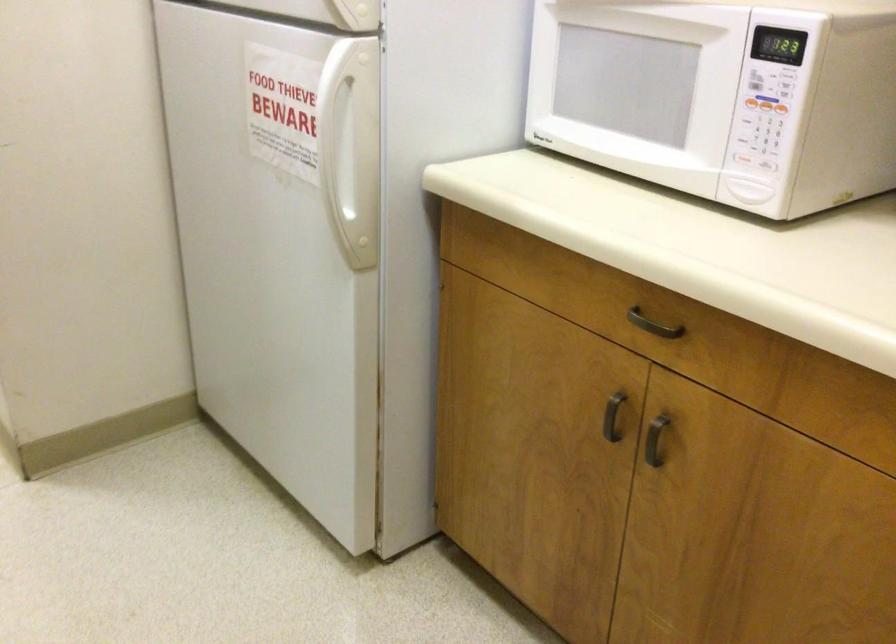
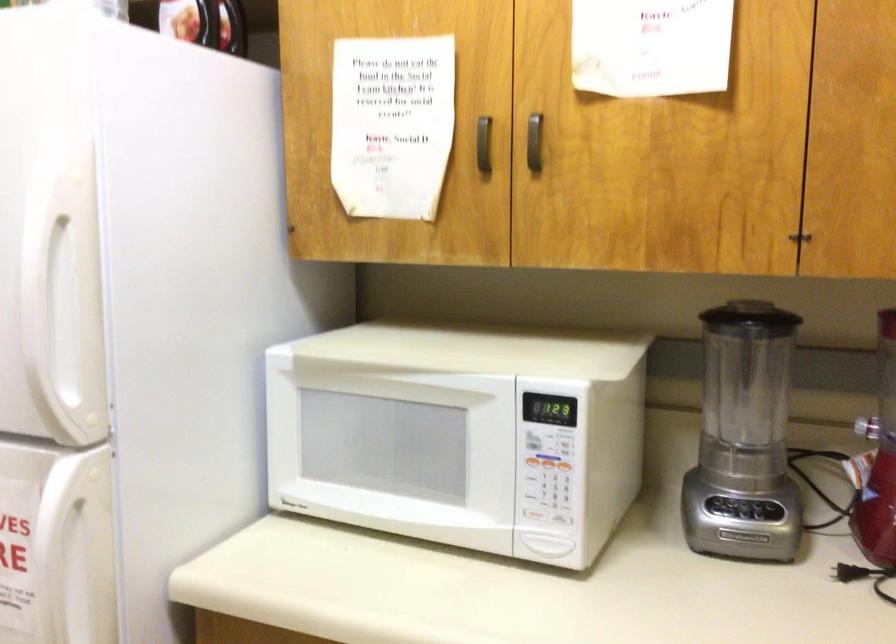
The point at (746, 98) is marked in the first image. Where is the corresponding point in the second image?

(530, 462)